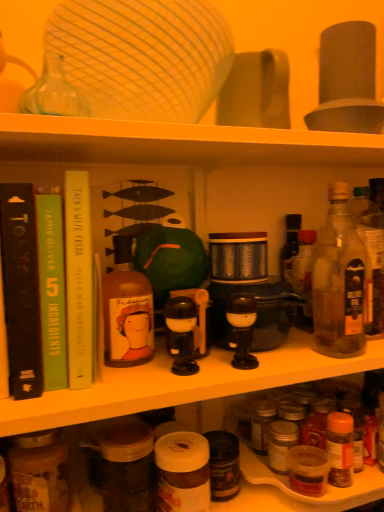
Locate an element on the screen. Image resolution: width=384 pixels, height=512 pixels. free location in front of black plastic toy at center is located at coordinates (157, 385).